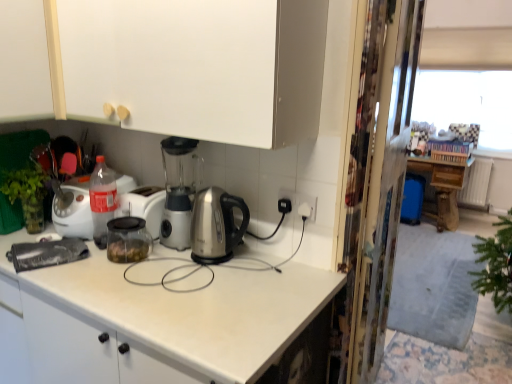
At what (x,y) coordinates should I click in order to perform the action: click on empty space that is ontop of clear glass jar at center (from a real-world perspective). Please return your answer as a coordinate pair (x, y). This screenshot has width=512, height=384. Looking at the image, I should click on (97, 174).